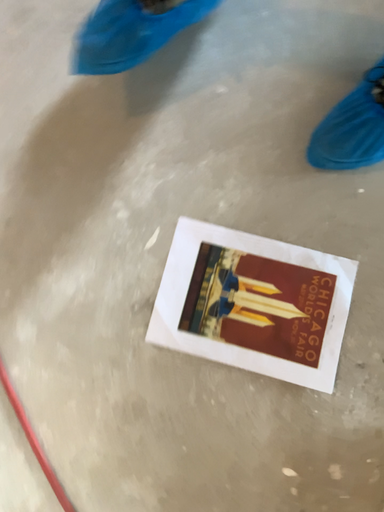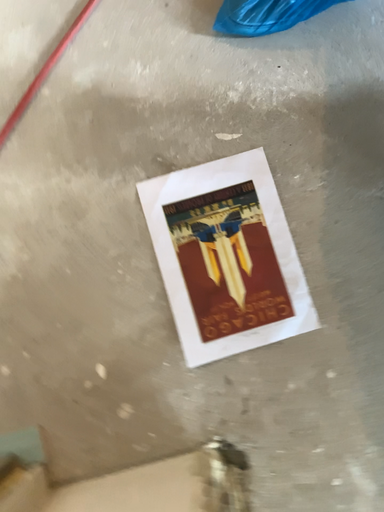
Question: How did the camera likely rotate when shooting the video?

Choices:
 (A) rotated left
 (B) rotated right

Answer: (A)